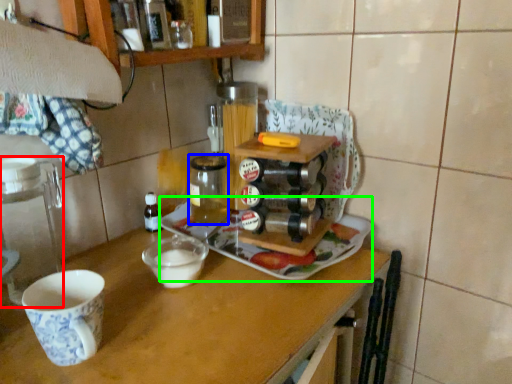
Question: Based on their relative distances, which object is nearer to appliance (highlighted by a red box)? Choose from beverage (highlighted by a blue box) and tray (highlighted by a green box).

Choices:
 (A) beverage
 (B) tray

Answer: (A)